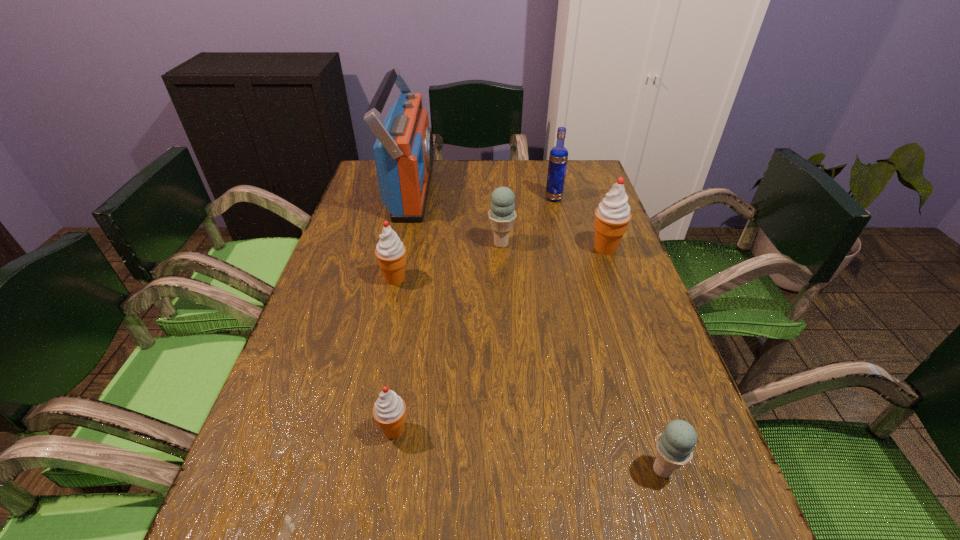
In order to click on the nearest red icecream in this screenshot , I will do `click(389, 411)`.

Where is `the second nearest object`? The height and width of the screenshot is (540, 960). the second nearest object is located at coordinates (389, 411).

At what (x,y) coordinates should I click in order to perform the action: click on the right blue ice cream. Please return your answer as a coordinate pair (x, y). Looking at the image, I should click on (674, 446).

Locate an element on the screen. This screenshot has width=960, height=540. the smaller blue ice cream is located at coordinates (674, 446).

Find the location of a particular element. vacant region located 0.120m on the front-facing side of the radio receiver is located at coordinates (470, 191).

Where is `free space located on the right of the vodka`? free space located on the right of the vodka is located at coordinates (582, 198).

Locate an element on the screen. The image size is (960, 540). vacant space located on the front of the tallest ice cream is located at coordinates (634, 329).

In order to click on free space located 0.280m on the right of the second smallest red icecream in this screenshot , I will do `click(525, 279)`.

Locate an element on the screen. Image resolution: width=960 pixels, height=540 pixels. vacant space located 0.090m on the right of the farther blue ice cream is located at coordinates (548, 244).

I want to click on free spot located on the left of the nearest red icecream, so click(258, 430).